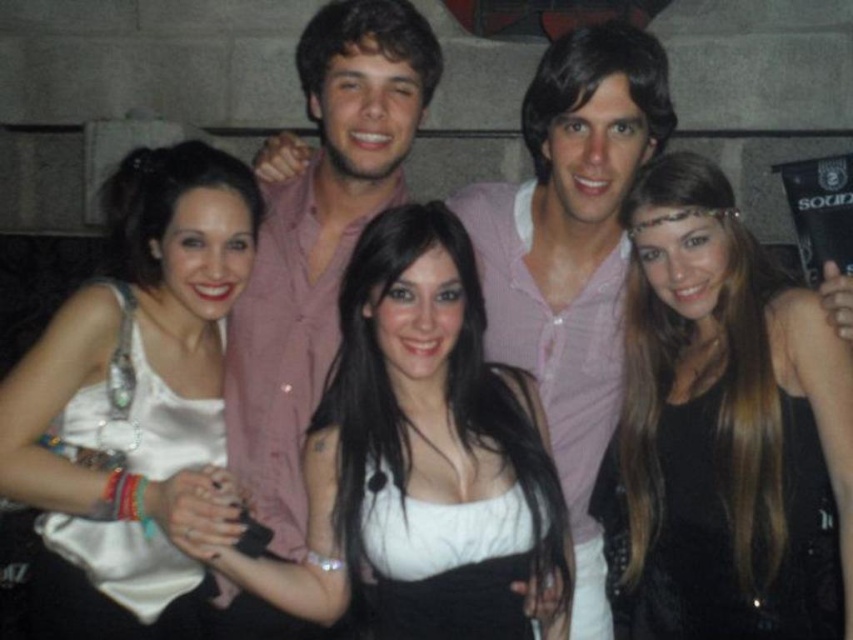
Which of these two, white satin dress at center or white satin tank top at center, stands shorter?

With less height is white satin dress at center.

Does point (479, 432) come behind point (67, 433)?

Yes, it is.

Measure the distance between point (428, 380) and camera.

Point (428, 380) is 3.89 meters away from camera.

I want to click on white satin dress at center, so click(421, 458).

Between black leather dress at center and white satin dress at center, which one has less height?

Standing shorter between the two is white satin dress at center.

Which is in front, point (665, 195) or point (393, 348)?

Point (393, 348) is more forward.

Between point (642, 582) and point (381, 586), which one is positioned behind?

Point (642, 582)

Identify the location of black leather dress at center. This screenshot has width=853, height=640. (724, 429).

From the picture: Is black leather dress at center further to the viewer compared to white satin tank top at center?

No, it is not.

Is black leather dress at center thinner than white satin tank top at center?

Incorrect, black leather dress at center's width is not less than white satin tank top at center's.

Is point (622, 566) positioned behind point (236, 273)?

Yes, it is behind point (236, 273).

The height and width of the screenshot is (640, 853). I want to click on black leather dress at center, so click(x=724, y=429).